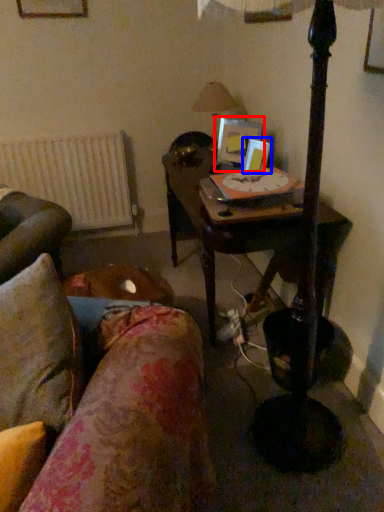
Question: Which object appears farthest to the camera in this image, picture frame (highlighted by a red box) or picture frame (highlighted by a blue box)?

Choices:
 (A) picture frame
 (B) picture frame

Answer: (A)